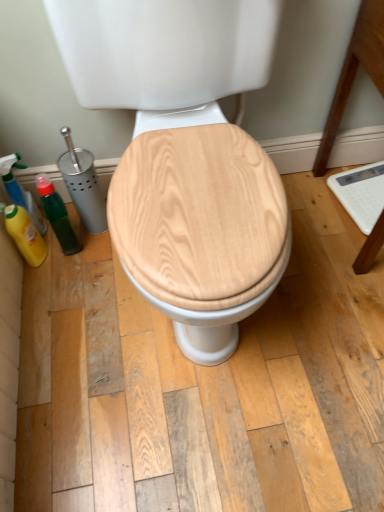
Locate an element on the screen. The width and height of the screenshot is (384, 512). empty space that is in between wooden toilet seat at center and green matte bottle at left is located at coordinates (103, 293).